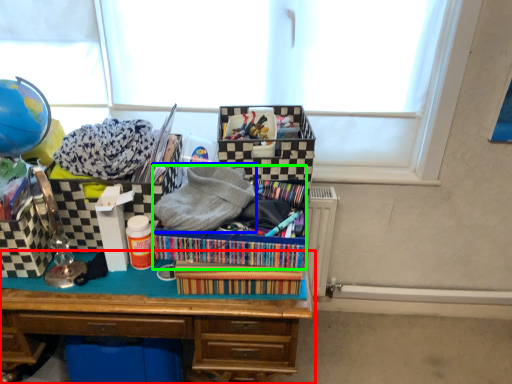
Question: Which object is positioned farthest from desk (highlighted by a red box)? Select from clothing (highlighted by a blue box) and kit (highlighted by a green box).

Choices:
 (A) clothing
 (B) kit

Answer: (A)